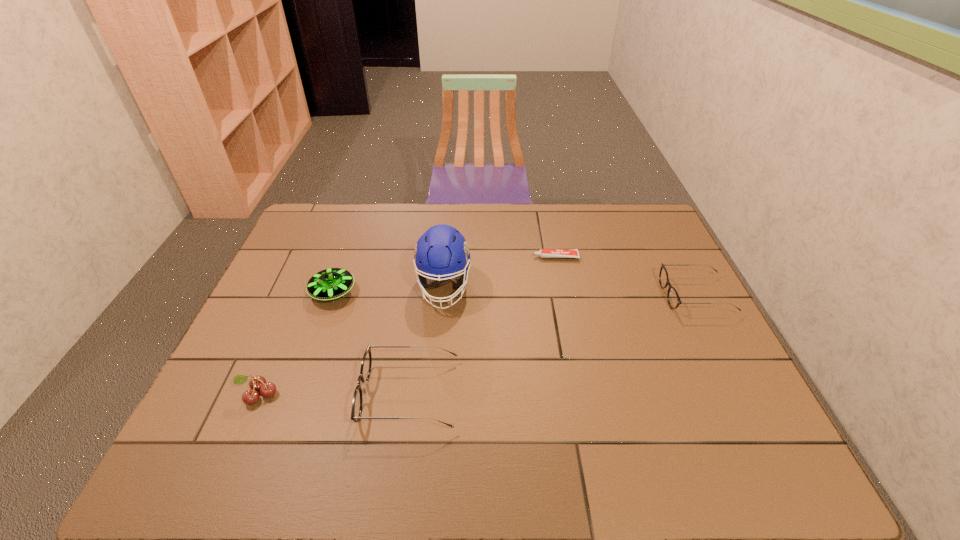
At what (x,y) coordinates should I click in order to perform the action: click on blank area located through the lenses of the nearer spectacles. Please return your answer as a coordinate pair (x, y). The height and width of the screenshot is (540, 960). Looking at the image, I should click on (258, 394).

Locate an element on the screen. This screenshot has width=960, height=540. vacant space located through the lenses of the nearer spectacles is located at coordinates (245, 394).

In order to click on free region located through the lenses of the shorter spectacles in this screenshot , I will do `click(613, 295)`.

This screenshot has height=540, width=960. In order to click on vacant space situated 0.300m through the lenses of the shorter spectacles in this screenshot , I will do `click(563, 295)`.

The height and width of the screenshot is (540, 960). I want to click on free space located 0.300m through the lenses of the shorter spectacles, so click(x=563, y=295).

Identify the location of vacant space located 0.120m at the nozzle of the fifth object from left to right. The height and width of the screenshot is (540, 960). (496, 257).

Identify the location of blank space located at the nozzle of the fifth object from left to right. Image resolution: width=960 pixels, height=540 pixels. (417, 257).

This screenshot has width=960, height=540. What are the coordinates of `vacant space located 0.320m at the nozzle of the fifth object from left to right` in the screenshot? It's located at (436, 257).

The image size is (960, 540). Find the location of `vacant space situated on the right of the saucer`. vacant space situated on the right of the saucer is located at coordinates (440, 292).

What are the coordinates of `vacant region located 0.100m on the front-facing side of the tallest object` in the screenshot? It's located at (439, 342).